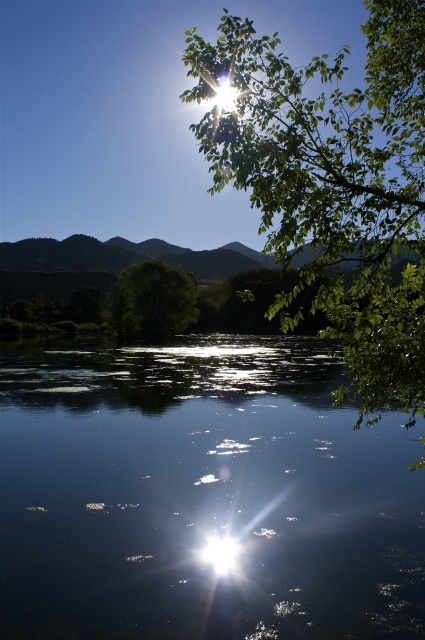
Question: Does green leafy tree at upper right appear on the left side of green leafy tree at center?

Choices:
 (A) yes
 (B) no

Answer: (B)

Question: Can you confirm if transparent water at center is smaller than green leafy tree at upper right?

Choices:
 (A) no
 (B) yes

Answer: (B)

Question: Which of the following is the farthest from the observer?

Choices:
 (A) (192, 429)
 (B) (121, 310)

Answer: (B)

Question: Estimate the real-world distances between objects in this image. Which object is farther from the green leafy tree at upper right?

Choices:
 (A) transparent water at center
 (B) green leafy tree at center

Answer: (B)

Question: Where is transparent water at center located in relation to green leafy tree at upper right in the image?

Choices:
 (A) right
 (B) left

Answer: (B)

Question: Which point is farther to the camera?

Choices:
 (A) (146, 276)
 (B) (384, 168)
 (C) (323, 440)

Answer: (A)